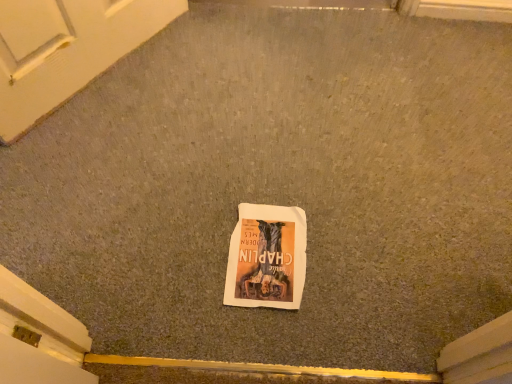
Where is `free region under white paper at center (from a real-world perspective)`? The height and width of the screenshot is (384, 512). free region under white paper at center (from a real-world perspective) is located at coordinates (268, 253).